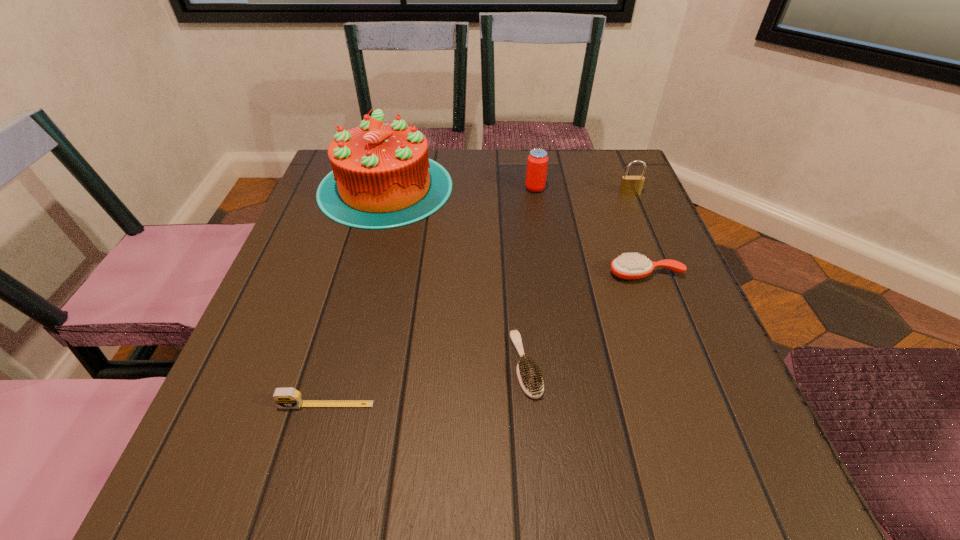
Locate an element on the screen. cake is located at coordinates (382, 177).

I want to click on the third object from right to left, so click(537, 162).

Locate an element on the screen. padlock is located at coordinates (630, 185).

The width and height of the screenshot is (960, 540). I want to click on hairbrush, so click(630, 266).

You are a GUI agent. You are given a task and a screenshot of the screen. Output one action in this format:
    pyautogui.click(x=<x>, y=<y>)
    Task: Click on the tape measure
    The width and height of the screenshot is (960, 540).
    Given the screenshot: What is the action you would take?
    pyautogui.click(x=285, y=398)

Where is `scrubbing brush`? Image resolution: width=960 pixels, height=540 pixels. scrubbing brush is located at coordinates (529, 375).

Locate an element on the screen. the shortest object is located at coordinates (529, 375).

I want to click on vacant space located 0.210m on the front of the tallest object, so click(x=355, y=300).

You are a GUI agent. You are given a task and a screenshot of the screen. Output one action in this format:
    pyautogui.click(x=<x>, y=<y>)
    Task: Click on the vacant space situated on the front of the third object from right to left
    
    Given the screenshot: What is the action you would take?
    pyautogui.click(x=552, y=298)

You are a GUI agent. You are given a task and a screenshot of the screen. Output one action in this format:
    pyautogui.click(x=<x>, y=<y>)
    Task: Click on the vacant space located 0.200m on the front-facing side of the padlock
    
    Given the screenshot: What is the action you would take?
    pyautogui.click(x=653, y=250)